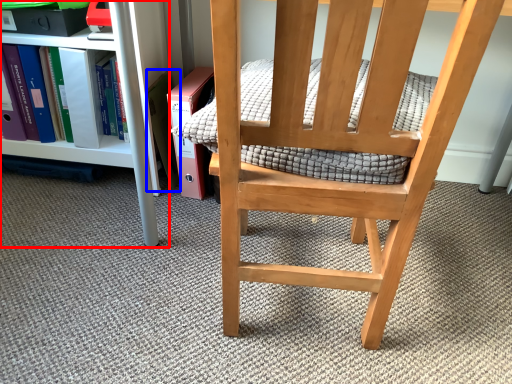
Question: Among these objects, which one is farthest to the camera, shelf (highlighted by a red box) or paperback book (highlighted by a blue box)?

Choices:
 (A) shelf
 (B) paperback book

Answer: (B)